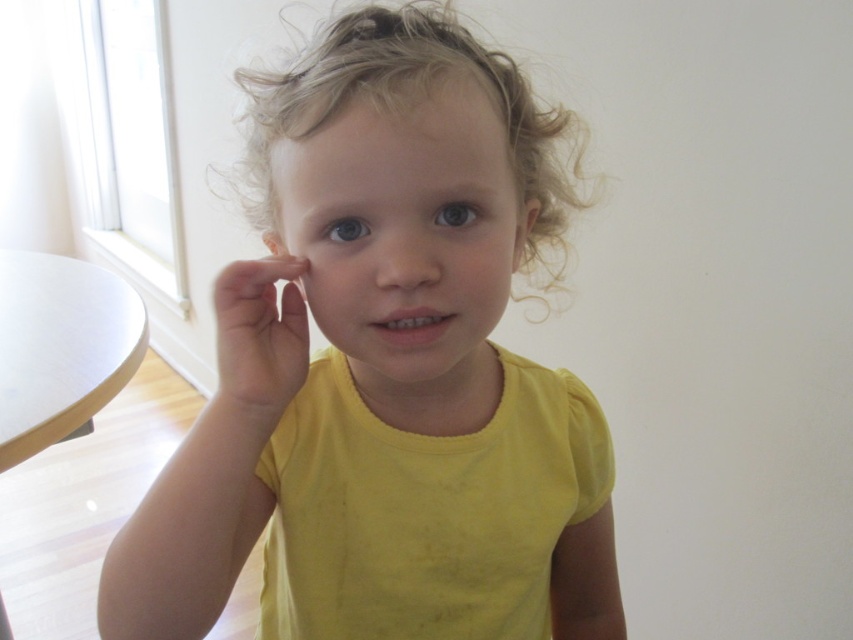
Question: Does curly blonde hair at center appear over white matte table at left?

Choices:
 (A) no
 (B) yes

Answer: (B)

Question: Which object is positioned closest to the curly blonde hair at center?

Choices:
 (A) white matte table at left
 (B) yellow matte shirt at center

Answer: (B)

Question: Can you confirm if yellow matte shirt at center is positioned above white matte table at left?

Choices:
 (A) yes
 (B) no

Answer: (B)

Question: Can you confirm if yellow matte shirt at center is wider than curly blonde hair at center?

Choices:
 (A) yes
 (B) no

Answer: (B)

Question: Which object is the closest to the white matte table at left?

Choices:
 (A) yellow matte shirt at center
 (B) curly blonde hair at center

Answer: (B)

Question: Which object appears farthest from the camera in this image?

Choices:
 (A) curly blonde hair at center
 (B) white matte table at left

Answer: (B)